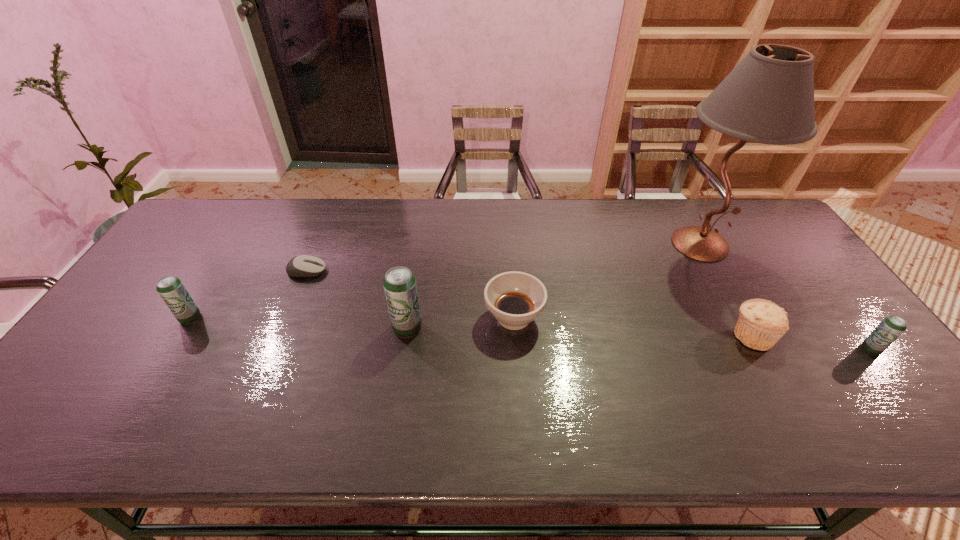
Locate an element on the screen. The height and width of the screenshot is (540, 960). free space between the muffin and the second tallest beer can is located at coordinates (471, 327).

This screenshot has height=540, width=960. What are the coordinates of `free space between the second shortest beer can and the rightmost object` in the screenshot? It's located at (531, 333).

Locate an element on the screen. free space between the rightmost object and the table lamp is located at coordinates (785, 296).

You are a GUI agent. You are given a task and a screenshot of the screen. Output one action in this format:
    pyautogui.click(x=<x>, y=<y>)
    Task: Click on the empty space that is in between the muffin and the leftmost object
    
    Given the screenshot: What is the action you would take?
    pyautogui.click(x=471, y=327)

The image size is (960, 540). Find the location of `free space between the nearest beer can and the second object from left to right`. free space between the nearest beer can and the second object from left to right is located at coordinates (588, 310).

Where is `free space between the computer equipment and the rightmost beer can`? free space between the computer equipment and the rightmost beer can is located at coordinates (588, 310).

Locate an element on the screen. vacant space that is in between the shortest object and the second tallest beer can is located at coordinates (249, 294).

In order to click on free spot between the tallest object and the fourth object from left to right in this screenshot , I will do `click(607, 281)`.

Image resolution: width=960 pixels, height=540 pixels. I want to click on vacant space that is in between the fourth object from left to right and the rightmost beer can, so click(692, 333).

Locate an element on the screen. The width and height of the screenshot is (960, 540). object that is the third closest to the fourth object from left to right is located at coordinates (303, 265).